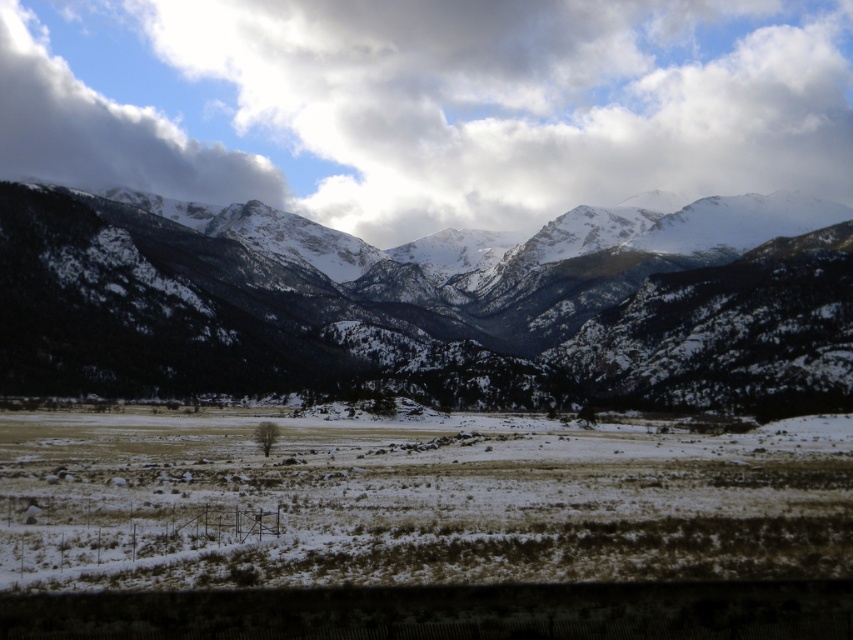
Does white fluffy cloud at upper center appear on the left side of brown dry grass at center?

Yes, white fluffy cloud at upper center is to the left of brown dry grass at center.

Is point (308, 173) positioned in front of point (645, 518)?

No, (308, 173) is further to viewer.

Describe the element at coordinates (428, 104) in the screenshot. I see `white fluffy cloud at upper center` at that location.

In order to click on white fluffy cloud at upper center in this screenshot , I will do `click(428, 104)`.

Does white fluffy cloud at upper center appear over white fluffy cloud at upper left?

Yes, white fluffy cloud at upper center is above white fluffy cloud at upper left.

Who is positioned more to the left, white fluffy cloud at upper center or white fluffy cloud at upper left?

Positioned to the left is white fluffy cloud at upper left.

This screenshot has height=640, width=853. Describe the element at coordinates (428, 104) in the screenshot. I see `white fluffy cloud at upper center` at that location.

This screenshot has height=640, width=853. Identify the location of white fluffy cloud at upper center. (428, 104).

In the scene shown: Is brown dry grass at center shorter than white fluffy cloud at upper left?

Correct, brown dry grass at center is not as tall as white fluffy cloud at upper left.

Which is behind, point (189, 470) or point (119, 163)?

Point (119, 163)

I want to click on brown dry grass at center, so click(415, 499).